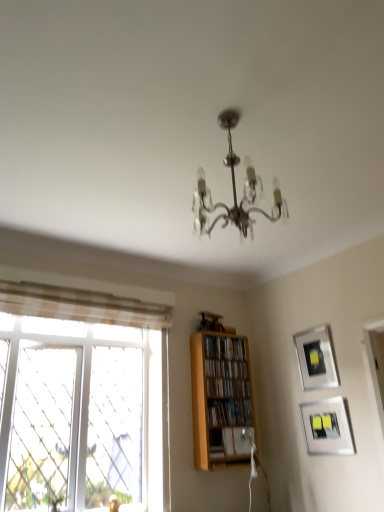
Identify the location of wooden bookshelf at center, the 3th book from the bottom. (227, 387).

You are a GUI agent. You are given a task and a screenshot of the screen. Output one action in this format:
    pyautogui.click(x=<x>, y=<y>)
    Task: Click on the matte silver picture frame at upper right, the 2th picture frame in the bottom-to-top sequence
    
    Given the screenshot: What is the action you would take?
    pyautogui.click(x=316, y=358)

Is wooden shelf at center beside wooden bookshelf at center, acting as the 4th book starting from the top?

No, wooden shelf at center is not touching wooden bookshelf at center, acting as the 4th book starting from the top.

Visually, is wooden shelf at center positioned to the left or to the right of wooden bookshelf at center, the 2th book in the bottom-to-top sequence?

Based on their positions, wooden shelf at center is located to the left of wooden bookshelf at center, the 2th book in the bottom-to-top sequence.

From the image's perspective, is wooden shelf at center beneath wooden bookshelf at center, acting as the 4th book starting from the top?

No, from the image's perspective, wooden shelf at center is not below wooden bookshelf at center, acting as the 4th book starting from the top.

The image size is (384, 512). Find the location of `shelf lying on the left of wooden bookshelf at center, the 2th book in the bottom-to-top sequence`. shelf lying on the left of wooden bookshelf at center, the 2th book in the bottom-to-top sequence is located at coordinates (220, 398).

Who is taller, matte silver picture frame at upper right, marked as the first picture frame in a top-to-bottom arrangement, or wooden bookshelf at center, the 2th book in the bottom-to-top sequence?

matte silver picture frame at upper right, marked as the first picture frame in a top-to-bottom arrangement, is taller.

The height and width of the screenshot is (512, 384). Find the location of `the 3rd book below the matte silver picture frame at upper right, marked as the first picture frame in a top-to-bottom arrangement (from a real-world perspective)`. the 3rd book below the matte silver picture frame at upper right, marked as the first picture frame in a top-to-bottom arrangement (from a real-world perspective) is located at coordinates (230, 413).

Would you say wooden bookshelf at center, acting as the 4th book starting from the top, is part of matte silver picture frame at upper right, the 2th picture frame in the bottom-to-top sequence,'s contents?

Definitely not — wooden bookshelf at center, acting as the 4th book starting from the top, is not inside matte silver picture frame at upper right, the 2th picture frame in the bottom-to-top sequence.

In terms of width, does matte silver picture frame at upper right, marked as the first picture frame in a top-to-bottom arrangement, look wider or thinner when compared to wooden bookshelf at center, acting as the 4th book starting from the top?

matte silver picture frame at upper right, marked as the first picture frame in a top-to-bottom arrangement, is thinner than wooden bookshelf at center, acting as the 4th book starting from the top.

Is point (208, 416) more distant than point (199, 430)?

Yes, point (208, 416) is farther from viewer.

Is wooden bookshelf at center, the 2th book in the bottom-to-top sequence, to the left or to the right of wooden shelf at center in the image?

wooden bookshelf at center, the 2th book in the bottom-to-top sequence, is positioned on wooden shelf at center's right side.

Looking at this image, is wooden bookshelf at center, the 2th book in the bottom-to-top sequence, not inside wooden shelf at center?

Actually, wooden bookshelf at center, the 2th book in the bottom-to-top sequence, is at least partially inside wooden shelf at center.

Are wooden bookshelf at center, the 3th book from the bottom, and wooden bookshelf at center, the second book viewed from the top, located far from each other?

That's not correct — wooden bookshelf at center, the 3th book from the bottom, is a little close to wooden bookshelf at center, the second book viewed from the top.

From a real-world perspective, is wooden bookshelf at center, which is the 3th book in top-to-bottom order, physically located above or below wooden bookshelf at center, the second book viewed from the top?

wooden bookshelf at center, which is the 3th book in top-to-bottom order, is below wooden bookshelf at center, the second book viewed from the top.

Do you think wooden bookshelf at center, the 3th book from the bottom, is within wooden bookshelf at center, the second book viewed from the top, or outside of it?

wooden bookshelf at center, the 3th book from the bottom, lies outside wooden bookshelf at center, the second book viewed from the top.

Considering the points (239, 386) and (214, 372), which point is in front, point (239, 386) or point (214, 372)?

Point (214, 372)

From the image's perspective, is wooden bookshelf at center, acting as the 4th book starting from the top, located beneath wooden bookshelf at center, which is the 3th book in top-to-bottom order?

Correct, wooden bookshelf at center, acting as the 4th book starting from the top, appears lower than wooden bookshelf at center, which is the 3th book in top-to-bottom order, in the image.

Are wooden bookshelf at center, the 2th book in the bottom-to-top sequence, and wooden bookshelf at center, the 3th book from the bottom, making contact?

No, wooden bookshelf at center, the 2th book in the bottom-to-top sequence, is not beside wooden bookshelf at center, the 3th book from the bottom.

The height and width of the screenshot is (512, 384). In order to click on the 1st book in front of the wooden bookshelf at center, the 3th book from the bottom in this screenshot , I will do `click(230, 413)`.

From a real-world perspective, is wooden bookshelf at center, acting as the 4th book starting from the top, located beneath wooden bookshelf at center, which is the 3th book in top-to-bottom order?

Yes, from a real-world perspective, wooden bookshelf at center, acting as the 4th book starting from the top, is under wooden bookshelf at center, which is the 3th book in top-to-bottom order.

From a real-world perspective, does wooden bookshelf at center, acting as the fifth book starting from the bottom, sit lower than wooden bookshelf at center, acting as the 4th book starting from the top?

No, from a real-world perspective, wooden bookshelf at center, acting as the fifth book starting from the bottom, is not under wooden bookshelf at center, acting as the 4th book starting from the top.

Can you confirm if wooden bookshelf at center, acting as the fifth book starting from the bottom, is positioned to the left of wooden bookshelf at center, acting as the 4th book starting from the top?

Yes.

Is wooden bookshelf at center, acting as the fifth book starting from the bottom, positioned with its back to wooden bookshelf at center, the 2th book in the bottom-to-top sequence?

That's not correct — wooden bookshelf at center, acting as the fifth book starting from the bottom, is not looking away from wooden bookshelf at center, the 2th book in the bottom-to-top sequence.

Considering the relative positions of wooden bookshelf at center, marked as the 1th book in a top-to-bottom arrangement, and wooden bookshelf at center, acting as the 4th book starting from the top, in the image provided, is wooden bookshelf at center, marked as the 1th book in a top-to-bottom arrangement, behind wooden bookshelf at center, acting as the 4th book starting from the top,?

Yes.

In the scene shown: Based on their positions, is clear glass window at left located to the left or right of wooden shelf at center?

clear glass window at left is to the left of wooden shelf at center.

Is wooden shelf at center at the back of clear glass window at left?

No, clear glass window at left's orientation is not away from wooden shelf at center.

Does clear glass window at left have a greater height compared to wooden shelf at center?

Correct, clear glass window at left is much taller as wooden shelf at center.

This screenshot has width=384, height=512. I want to click on shelf located on the right of clear glass window at left, so click(220, 398).

This screenshot has width=384, height=512. I want to click on book that is the 3rd one when counting rightward from the wooden shelf at center, so click(230, 413).

Which book is the 2nd one when counting from the back of the matte silver picture frame at upper right, the 2th picture frame in the bottom-to-top sequence? Please provide its 2D coordinates.

[(230, 413)]

Considering their positions, is wooden shelf at center positioned further to matte silver picture frame at lower right, the 1th picture frame from the bottom, than wooden bookshelf at center, acting as the 4th book starting from the top?

Among the two, wooden shelf at center is located further to matte silver picture frame at lower right, the 1th picture frame from the bottom.

Considering their positions, is clear glass window at left positioned further to matte silver picture frame at lower right, the 1th picture frame from the bottom, than matte silver picture frame at upper right, the 2th picture frame in the bottom-to-top sequence?

clear glass window at left.

Which object lies nearer to the anchor point wooden bookshelf at center, the 4th book from the bottom, wooden bookshelf at center, acting as the 4th book starting from the top, or wooden shelf at center?

wooden shelf at center lies closer to wooden bookshelf at center, the 4th book from the bottom, than the other object.

Which object lies further to the anchor point hardcover book at center, acting as the 5th book starting from the top, wooden bookshelf at center, which is the 3th book in top-to-bottom order, or clear glass window at left?

clear glass window at left is further to hardcover book at center, acting as the 5th book starting from the top.

Looking at the image, which one is located further to wooden bookshelf at center, the 3th book from the bottom, wooden bookshelf at center, the 2th book in the bottom-to-top sequence, or hardcover book at center, acting as the 5th book starting from the top?

Based on the image, hardcover book at center, acting as the 5th book starting from the top, appears to be further to wooden bookshelf at center, the 3th book from the bottom.

Based on their spatial positions, is wooden bookshelf at center, the second book viewed from the top, or matte silver picture frame at upper right, marked as the first picture frame in a top-to-bottom arrangement, closer to hardcover book at center, which appears as the first book when ordered from the bottom?

The object closer to hardcover book at center, which appears as the first book when ordered from the bottom, is wooden bookshelf at center, the second book viewed from the top.

From the image, which object appears to be nearer to wooden bookshelf at center, the 4th book from the bottom, matte silver picture frame at upper right, marked as the first picture frame in a top-to-bottom arrangement, or clear glass window at left?

Among the two, matte silver picture frame at upper right, marked as the first picture frame in a top-to-bottom arrangement, is located nearer to wooden bookshelf at center, the 4th book from the bottom.

When comparing their distances from matte silver picture frame at lower right, the 1th picture frame from the bottom, does wooden bookshelf at center, the 3th book from the bottom, or hardcover book at center, which appears as the first book when ordered from the bottom, seem closer?

The object closer to matte silver picture frame at lower right, the 1th picture frame from the bottom, is hardcover book at center, which appears as the first book when ordered from the bottom.

Identify the location of shelf between wooden bookshelf at center, marked as the 1th book in a top-to-bottom arrangement, and wooden bookshelf at center, acting as the 4th book starting from the top, vertically. Image resolution: width=384 pixels, height=512 pixels. (220, 398).

Where is `book situated between clear glass window at left and wooden bookshelf at center, the 4th book from the bottom, from left to right`? book situated between clear glass window at left and wooden bookshelf at center, the 4th book from the bottom, from left to right is located at coordinates (225, 348).

This screenshot has height=512, width=384. Find the location of `shelf between wooden bookshelf at center, marked as the 1th book in a top-to-bottom arrangement, and hardcover book at center, which appears as the first book when ordered from the bottom, in the vertical direction`. shelf between wooden bookshelf at center, marked as the 1th book in a top-to-bottom arrangement, and hardcover book at center, which appears as the first book when ordered from the bottom, in the vertical direction is located at coordinates (220, 398).

Locate an element on the screen. shelf situated between wooden bookshelf at center, acting as the fifth book starting from the bottom, and matte silver picture frame at upper right, marked as the first picture frame in a top-to-bottom arrangement, from left to right is located at coordinates (220, 398).